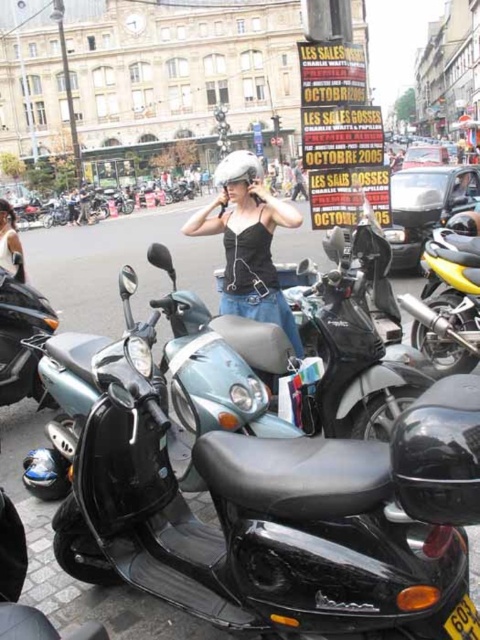
You are a delivery person who needs to retrieve your shiny black scooter at lower left from behind the black matte tank top at center. Can you easily access it without moving the other scooters?

The shiny black scooter at lower left is behind the black matte tank top at center, so you cannot easily access it without moving the other scooters or the tank top.